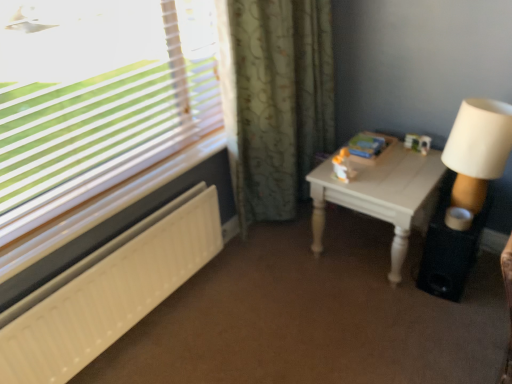
Question: Does green floral fabric curtain at center have a larger size compared to white wood table at right?

Choices:
 (A) no
 (B) yes

Answer: (B)

Question: Is green floral fabric curtain at center aimed at white wood table at right?

Choices:
 (A) no
 (B) yes

Answer: (B)

Question: Is green floral fabric curtain at center not inside white wood table at right?

Choices:
 (A) no
 (B) yes

Answer: (B)

Question: From a real-world perspective, is green floral fabric curtain at center located higher than white wood table at right?

Choices:
 (A) no
 (B) yes

Answer: (B)

Question: Can you confirm if green floral fabric curtain at center is positioned to the left of white wood table at right?

Choices:
 (A) yes
 (B) no

Answer: (A)

Question: Is white wood table at right at the back of green floral fabric curtain at center?

Choices:
 (A) no
 (B) yes

Answer: (A)

Question: Could you tell me if black matte speaker at lower right is turned towards white textured radiator at lower left?

Choices:
 (A) no
 (B) yes

Answer: (A)

Question: From the image's perspective, is black matte speaker at lower right located above white textured radiator at lower left?

Choices:
 (A) yes
 (B) no

Answer: (A)

Question: Can you confirm if black matte speaker at lower right is wider than white textured radiator at lower left?

Choices:
 (A) no
 (B) yes

Answer: (B)

Question: Is black matte speaker at lower right surrounding white textured radiator at lower left?

Choices:
 (A) yes
 (B) no

Answer: (B)

Question: Can you confirm if black matte speaker at lower right is positioned to the left of white textured radiator at lower left?

Choices:
 (A) yes
 (B) no

Answer: (B)

Question: Does black matte speaker at lower right have a smaller size compared to white textured radiator at lower left?

Choices:
 (A) yes
 (B) no

Answer: (A)

Question: Is white textured radiator at lower left wider than white wood table at right?

Choices:
 (A) yes
 (B) no

Answer: (B)